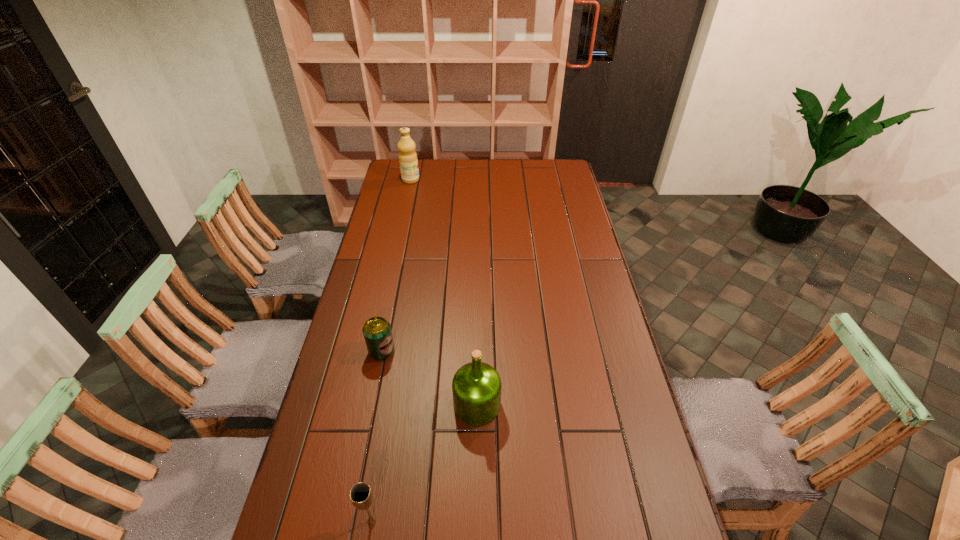
Where is `free space between the right olive oil and the farthest object`? The image size is (960, 540). free space between the right olive oil and the farthest object is located at coordinates (444, 292).

The width and height of the screenshot is (960, 540). Identify the location of vacant region between the shortest object and the nearest object. (377, 436).

Find the location of `free space between the third nearest object and the chalice`. free space between the third nearest object and the chalice is located at coordinates (377, 436).

Locate an element on the screen. unoccupied area between the chalice and the beer can is located at coordinates (377, 436).

The width and height of the screenshot is (960, 540). I want to click on unoccupied area between the shortest object and the farthest object, so click(396, 266).

This screenshot has height=540, width=960. In order to click on vacant area that lies between the farthest object and the right olive oil in this screenshot , I will do `click(444, 292)`.

You are a GUI agent. You are given a task and a screenshot of the screen. Output one action in this format:
    pyautogui.click(x=<x>, y=<y>)
    Task: Click on the vacant space in between the third tallest object and the right olive oil
    
    Given the screenshot: What is the action you would take?
    pyautogui.click(x=424, y=463)

This screenshot has width=960, height=540. I want to click on object that can be found as the second closest to the nearest object, so click(x=377, y=332).

Find the location of a particular element. The height and width of the screenshot is (540, 960). object that stands as the third closest to the second shortest object is located at coordinates click(408, 162).

You are a GUI agent. You are given a task and a screenshot of the screen. Output one action in this format:
    pyautogui.click(x=<x>, y=<y>)
    Task: Click on the vacant space that satisfies the following two spatial constraints: 1. on the label of the left olive oil; 2. on the right side of the right olive oil
    The height and width of the screenshot is (540, 960).
    Given the screenshot: What is the action you would take?
    pyautogui.click(x=361, y=405)